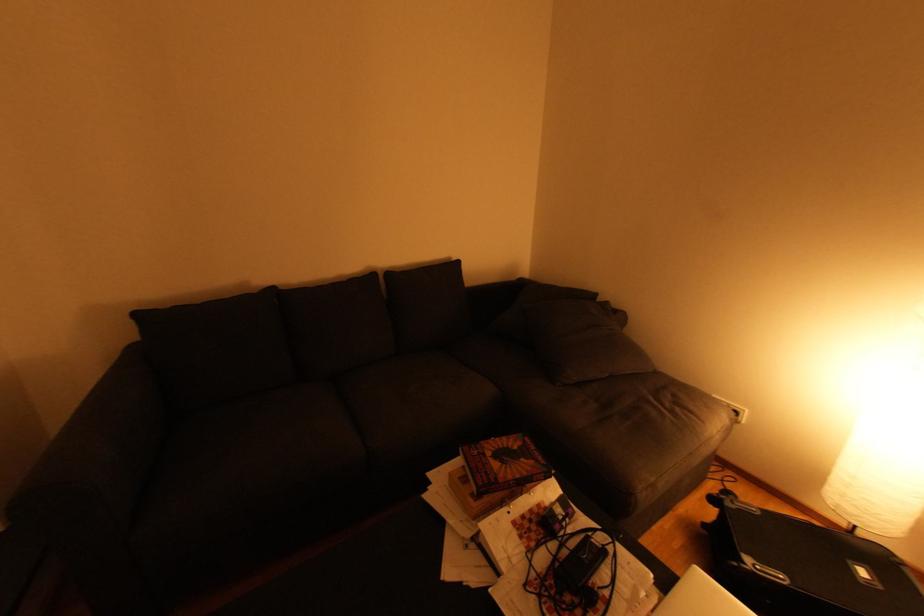
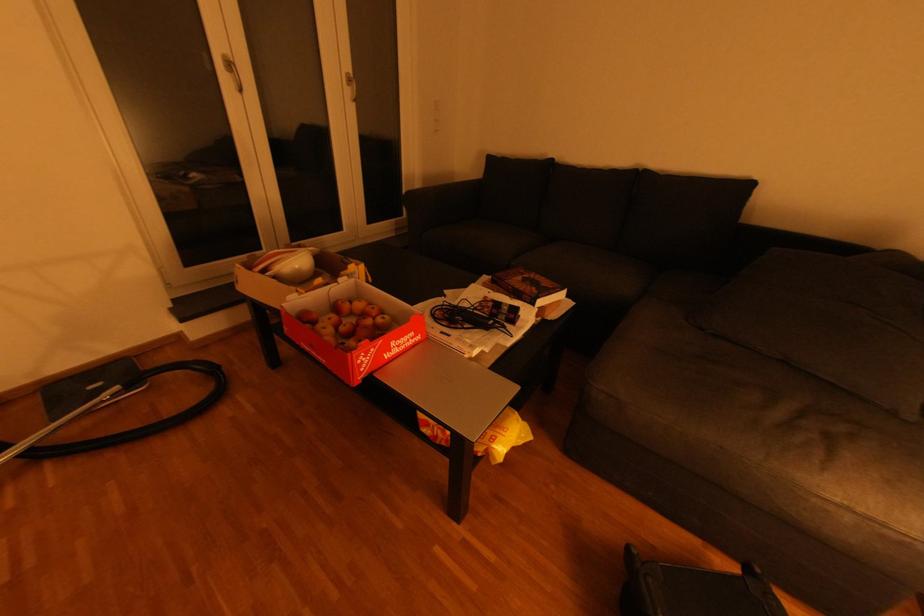
Where in the second image is the point corresponding to [527,460] from the first image?

(539, 289)